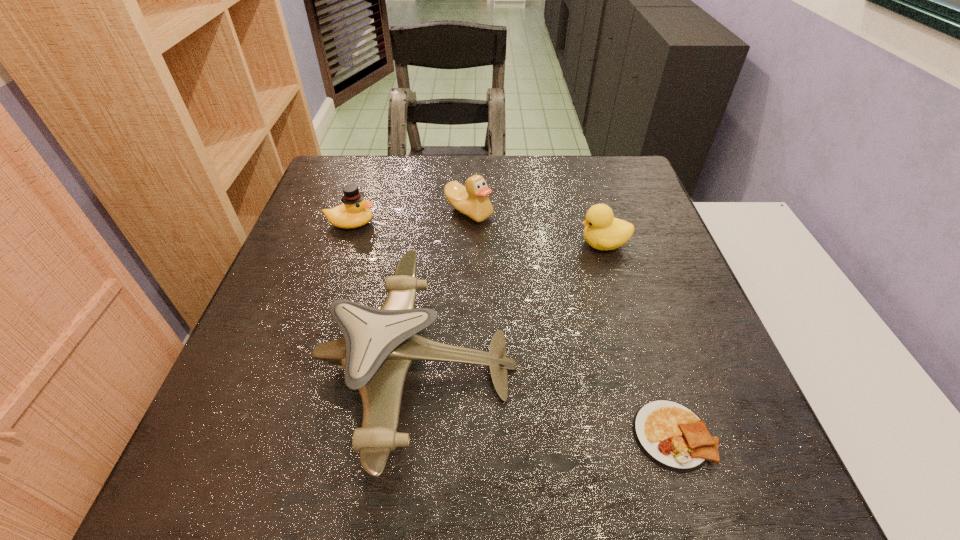
This screenshot has height=540, width=960. Find the location of `free space located 0.190m on the front-facing side of the drone`. free space located 0.190m on the front-facing side of the drone is located at coordinates (620, 366).

Where is `vacant position located on the left of the omelet`? This screenshot has height=540, width=960. vacant position located on the left of the omelet is located at coordinates (455, 435).

At what (x,y) coordinates should I click in order to perform the action: click on object that is at the far edge. Please return your answer as a coordinate pair (x, y). This screenshot has width=960, height=540. Looking at the image, I should click on (472, 200).

At what (x,y) coordinates should I click in order to perform the action: click on drone located in the near edge section of the desktop. Please return your answer as a coordinate pair (x, y). Looking at the image, I should click on (378, 346).

Find the location of `omelet that is positioned at the near edge`. omelet that is positioned at the near edge is located at coordinates (671, 435).

Where is `duck located at the left edge`? This screenshot has height=540, width=960. duck located at the left edge is located at coordinates (355, 212).

At what (x,y) coordinates should I click in order to perform the action: click on drone situated at the left edge. Please return your answer as a coordinate pair (x, y). Image resolution: width=960 pixels, height=540 pixels. Looking at the image, I should click on (378, 346).

Locate an element on the screen. duck positioned at the right edge is located at coordinates (602, 231).

I want to click on omelet at the right edge, so click(671, 435).

Locate an element on the screen. The width and height of the screenshot is (960, 540). object that is at the near left corner is located at coordinates (378, 346).